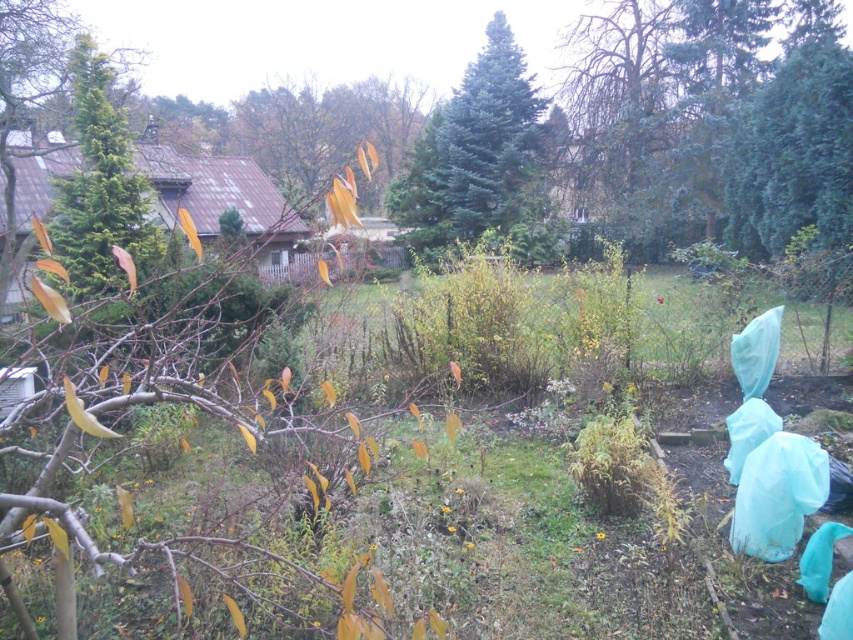
Does green matte evergreen tree at center have a greater height compared to green needle-like tree at left?

Correct, green matte evergreen tree at center is much taller as green needle-like tree at left.

Is green matte evergreen tree at center thinner than green needle-like tree at left?

In fact, green matte evergreen tree at center might be wider than green needle-like tree at left.

At what (x,y) coordinates should I click in order to perform the action: click on green matte evergreen tree at center. Please return your answer as a coordinate pair (x, y). This screenshot has width=853, height=640. Looking at the image, I should click on (480, 161).